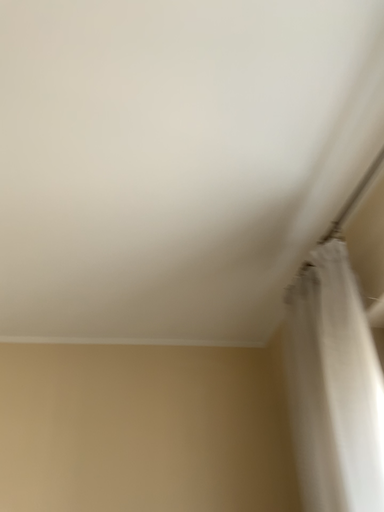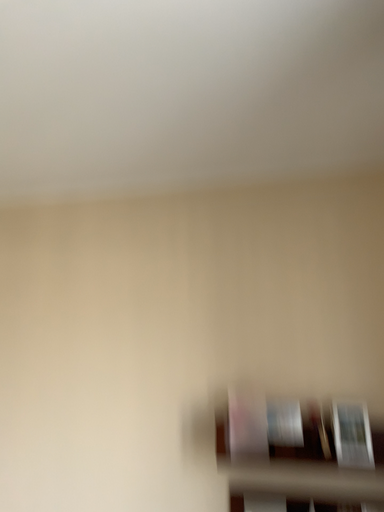
Question: Which way did the camera rotate in the video?

Choices:
 (A) rotated upward
 (B) rotated downward

Answer: (B)